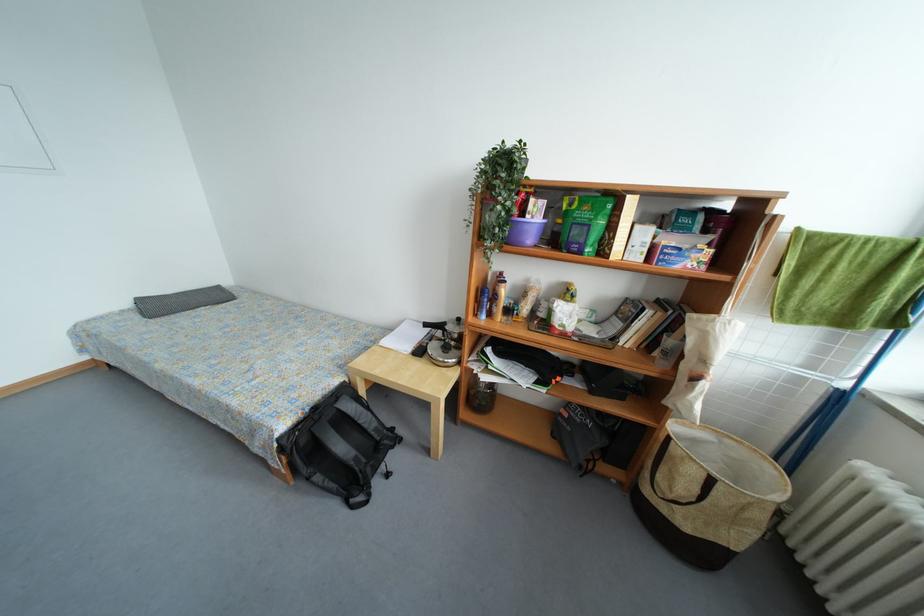
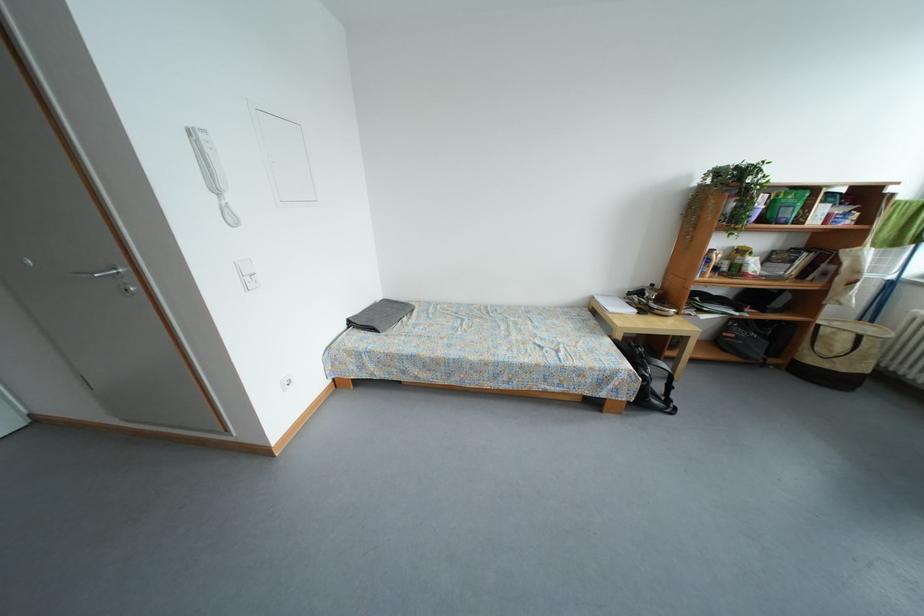
Question: What movement of the cameraman would produce the second image?

Choices:
 (A) Left
 (B) Right
 (C) Forward
 (D) Backward

Answer: (A)